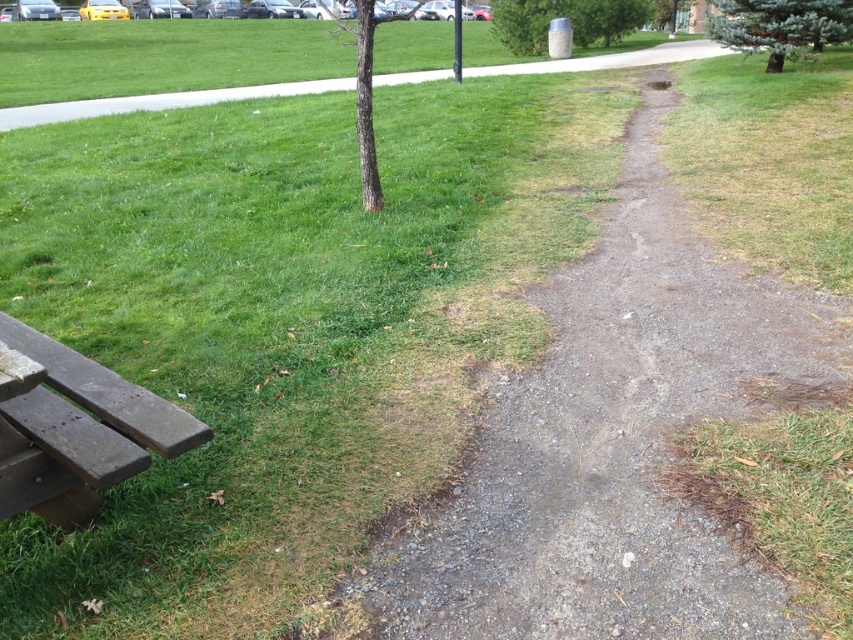
Does dirt/gravel path at center have a larger size compared to green needle-like tree at upper right?

Indeed, dirt/gravel path at center has a larger size compared to green needle-like tree at upper right.

Between dirt/gravel path at center and green needle-like tree at upper right, which one has more height?

dirt/gravel path at center

Who is more distant from viewer, (x=553, y=275) or (x=755, y=33)?

Positioned behind is point (x=755, y=33).

The height and width of the screenshot is (640, 853). Identify the location of dirt/gravel path at center. (618, 432).

Is point (125, 428) farther from viewer compared to point (762, 1)?

No, (125, 428) is closer to viewer.

Does point (122, 426) lie behind point (738, 19)?

No, (122, 426) is in front of (738, 19).

Locate an element on the screen. The width and height of the screenshot is (853, 640). weathered wood bench at lower left is located at coordinates (83, 422).

Is weathered wood bench at lower left to the left of gray textured trash can at upper center from the viewer's perspective?

Indeed, weathered wood bench at lower left is positioned on the left side of gray textured trash can at upper center.

Is weathered wood bench at lower left below gray textured trash can at upper center?

Yes.

At what (x,y) coordinates should I click in order to perform the action: click on weathered wood bench at lower left. Please return your answer as a coordinate pair (x, y). Looking at the image, I should click on (83, 422).

Where is `weathered wood bench at lower left`? Image resolution: width=853 pixels, height=640 pixels. weathered wood bench at lower left is located at coordinates (83, 422).